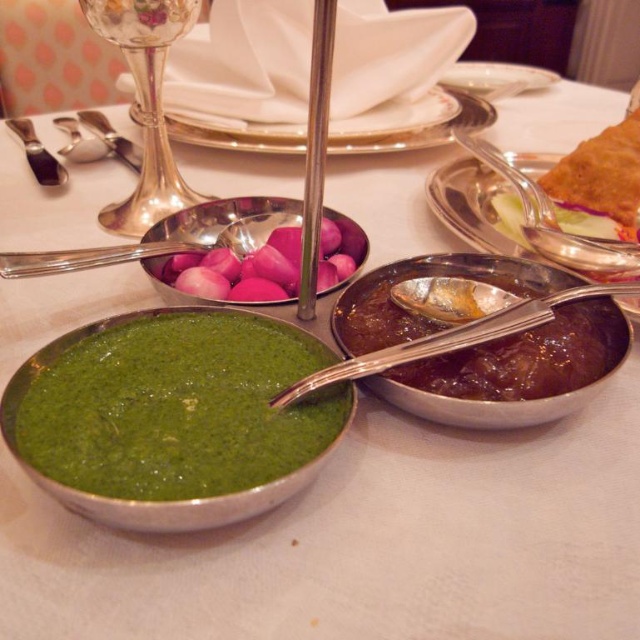
Is silver/glass wine glass at upper left wider than white porcelain plate at upper center?

No, silver/glass wine glass at upper left is not wider than white porcelain plate at upper center.

Is silver/glass wine glass at upper left further to the viewer compared to white porcelain plate at upper center?

No, silver/glass wine glass at upper left is in front of white porcelain plate at upper center.

Who is more forward, (x=93, y=19) or (x=460, y=65)?

Point (x=93, y=19)

Image resolution: width=640 pixels, height=640 pixels. I want to click on silver/glass wine glass at upper left, so click(x=145, y=104).

Is point (513, 339) closer to camera compared to point (205, 128)?

Yes, point (513, 339) is closer to viewer.

Who is positioned more to the right, shiny metallic bowl at center or metallic silver plate at center?

From the viewer's perspective, shiny metallic bowl at center appears more on the right side.

You are a GUI agent. You are given a task and a screenshot of the screen. Output one action in this format:
    pyautogui.click(x=<x>, y=<y>)
    Task: Click on the shiny metallic bowl at center
    This screenshot has width=640, height=640.
    Given the screenshot: What is the action you would take?
    pyautogui.click(x=515, y=372)

Is point (140, 516) in front of point (547, 76)?

Yes, it is.

How far apart are green matte bowl at lower left and white porcelain plate at upper center?

A distance of 25.50 inches exists between green matte bowl at lower left and white porcelain plate at upper center.

Where is `green matte bowl at lower left`? This screenshot has height=640, width=640. green matte bowl at lower left is located at coordinates (172, 417).